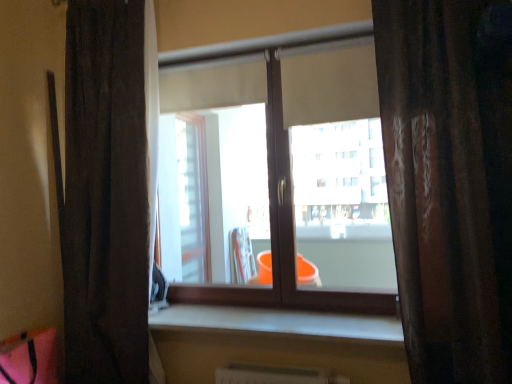
Where is `free spot above transparent glass window at center (from a real-world perspective)`? free spot above transparent glass window at center (from a real-world perspective) is located at coordinates (270, 42).